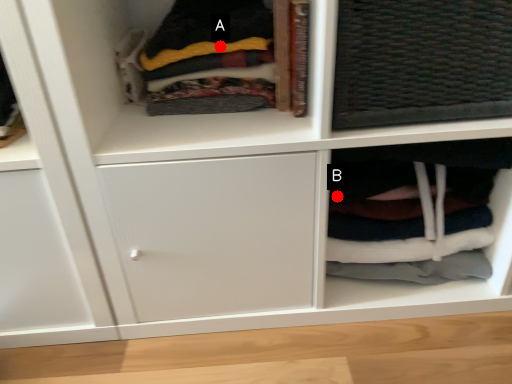
Question: Two points are circled on the image, labeled by A and B beside each circle. Which point is farther to the camera?

Choices:
 (A) A is further
 (B) B is further

Answer: (B)